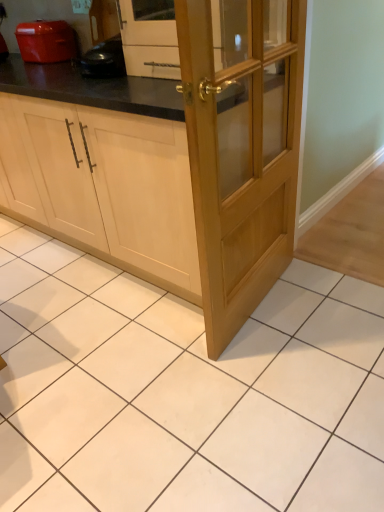
Question: Is matte orange toaster at upper left to the right of light wood cabinet at center from the viewer's perspective?

Choices:
 (A) no
 (B) yes

Answer: (B)

Question: Does matte orange toaster at upper left have a smaller size compared to light wood cabinet at center?

Choices:
 (A) yes
 (B) no

Answer: (A)

Question: Is matte orange toaster at upper left turned away from light wood cabinet at center?

Choices:
 (A) yes
 (B) no

Answer: (B)

Question: Does matte orange toaster at upper left have a larger size compared to light wood cabinet at center?

Choices:
 (A) no
 (B) yes

Answer: (A)

Question: Is matte orange toaster at upper left taller than light wood cabinet at center?

Choices:
 (A) yes
 (B) no

Answer: (B)

Question: From a real-world perspective, is light wood/glass door at center physically located above or below light wood cabinet at center?

Choices:
 (A) above
 (B) below

Answer: (A)

Question: Is light wood/glass door at center taller or shorter than light wood cabinet at center?

Choices:
 (A) short
 (B) tall

Answer: (B)

Question: From the image's perspective, is light wood/glass door at center positioned above or below light wood cabinet at center?

Choices:
 (A) below
 (B) above

Answer: (A)

Question: Looking at the image, does light wood/glass door at center seem bigger or smaller compared to light wood cabinet at center?

Choices:
 (A) big
 (B) small

Answer: (B)

Question: From a real-world perspective, relative to light wood/glass door at center, is matte orange toaster at upper left vertically above or below?

Choices:
 (A) below
 (B) above

Answer: (B)

Question: Is matte orange toaster at upper left taller or shorter than light wood/glass door at center?

Choices:
 (A) short
 (B) tall

Answer: (A)

Question: Is matte orange toaster at upper left in front of or behind light wood/glass door at center in the image?

Choices:
 (A) front
 (B) behind

Answer: (B)

Question: Is point (23, 41) closer or farther from the camera than point (193, 120)?

Choices:
 (A) closer
 (B) farther

Answer: (B)

Question: Is light wood cabinet at center spatially inside matte orange toaster at upper left, or outside of it?

Choices:
 (A) outside
 (B) inside

Answer: (A)

Question: From the image's perspective, is light wood cabinet at center located above or below matte orange toaster at upper left?

Choices:
 (A) below
 (B) above

Answer: (A)